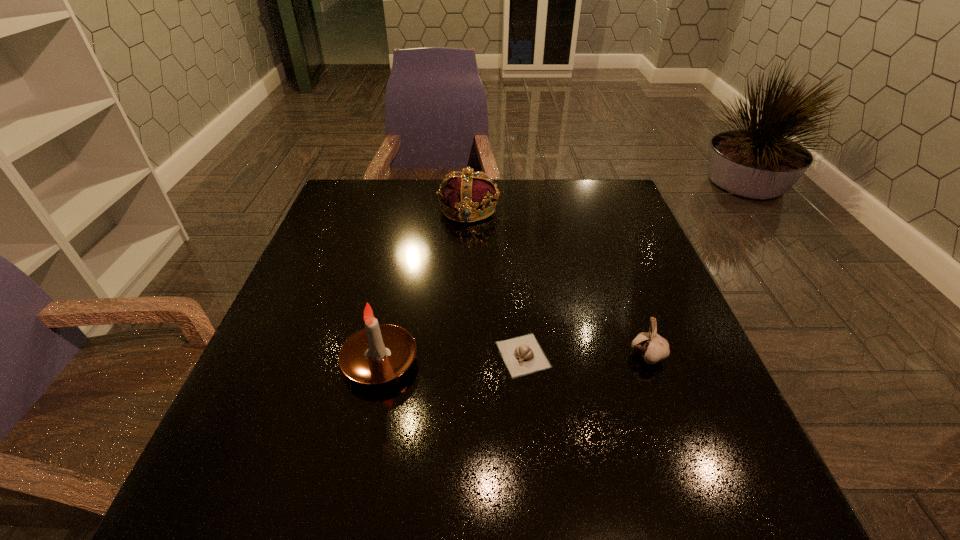
You are a GUI agent. You are given a task and a screenshot of the screen. Output one action in this format:
    pyautogui.click(x=<x>, y=<y>)
    Task: Click on the vacant area in the image that satisfies the following two spatial constraints: 1. on the front side of the second tallest object; 2. on the right side of the right garlic
    The width and height of the screenshot is (960, 540).
    Given the screenshot: What is the action you would take?
    pyautogui.click(x=464, y=356)

In order to click on free space that satisfies the following two spatial constraints: 1. on the back side of the farthest object; 2. on the left side of the tallest object in this screenshot , I will do `click(413, 209)`.

Locate an element on the screen. This screenshot has height=540, width=960. free location that satisfies the following two spatial constraints: 1. on the front side of the shorter garlic; 2. on the left side of the farthest object is located at coordinates (464, 355).

Where is `blank space that satisfies the following two spatial constraints: 1. on the back side of the left garlic; 2. on the right side of the tallest object`? The width and height of the screenshot is (960, 540). blank space that satisfies the following two spatial constraints: 1. on the back side of the left garlic; 2. on the right side of the tallest object is located at coordinates (381, 355).